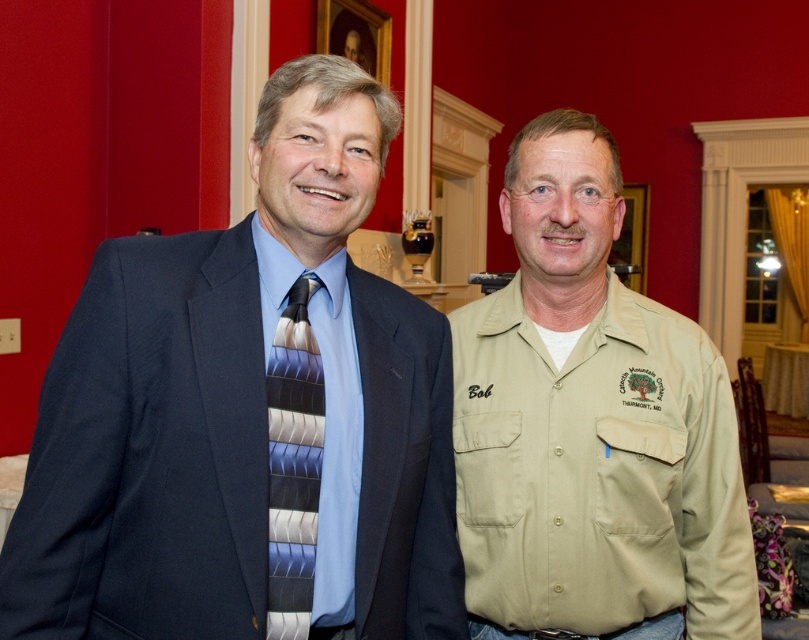
You are a photographer at a networking event. You need to capture a photo that highlights the matte black suit at center and the beige cotton shirt at center. Based on their positions, which one should you focus on first to ensure it appears larger in the frame?

The matte black suit at center is above the beige cotton shirt at center, so focusing on the matte black suit at center first will make it appear larger in the frame since it is positioned higher up.